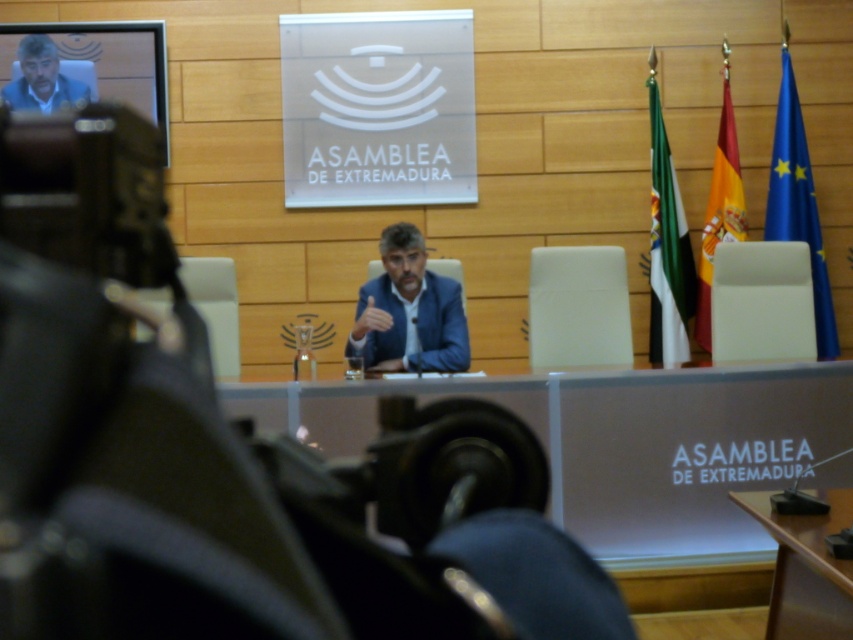
Question: Estimate the real-world distances between objects in this image. Which object is closer to the blue fabric suit at center?

Choices:
 (A) matte blue suit at upper left
 (B) wooden table at center

Answer: (B)

Question: Which point is closer to the camera?

Choices:
 (A) matte blue suit at upper left
 (B) wooden table at center

Answer: (B)

Question: Is blue fabric suit at center smaller than wooden table at center?

Choices:
 (A) no
 (B) yes

Answer: (A)

Question: Does blue fabric suit at center appear on the left side of matte blue suit at upper left?

Choices:
 (A) yes
 (B) no

Answer: (B)

Question: Can you confirm if blue fabric suit at center is positioned below matte blue suit at upper left?

Choices:
 (A) yes
 (B) no

Answer: (A)

Question: Which of these objects is positioned farthest from the matte blue suit at upper left?

Choices:
 (A) blue fabric suit at center
 (B) wooden table at center

Answer: (B)